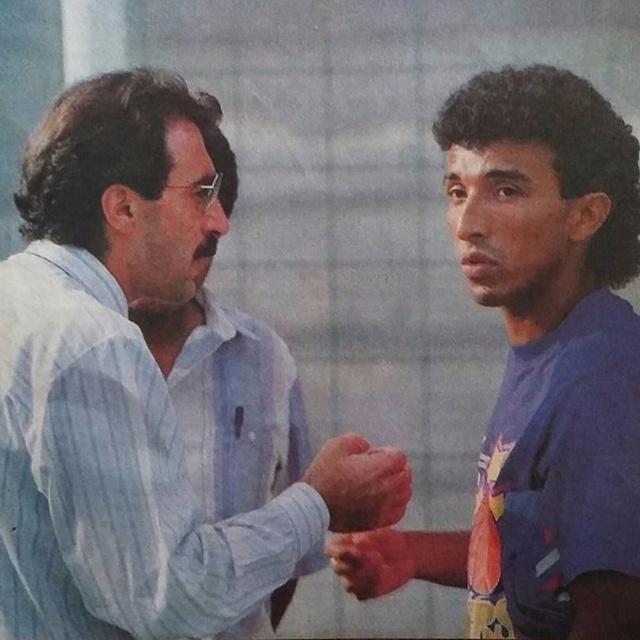
Question: Which point is closer to the camera?

Choices:
 (A) (28, 205)
 (B) (588, 252)
 (C) (340, 461)
 (D) (380, 536)

Answer: (B)

Question: Which point is closer to the camera?

Choices:
 (A) matte skin hand at center
 (B) blue matte shirt at right
 (C) smooth skin hand at center

Answer: (B)

Question: Can you confirm if blue striped shirt at center is smaller than matte skin hand at center?

Choices:
 (A) yes
 (B) no

Answer: (B)

Question: Is blue matte shirt at right closer to the viewer compared to matte skin hand at center?

Choices:
 (A) no
 (B) yes

Answer: (B)

Question: Considering the real-world distances, which object is farthest from the blue matte shirt at right?

Choices:
 (A) blue striped shirt at center
 (B) matte skin hand at center
 (C) smooth skin hand at center

Answer: (A)

Question: Is blue matte shirt at right above smooth skin hand at center?

Choices:
 (A) no
 (B) yes

Answer: (B)